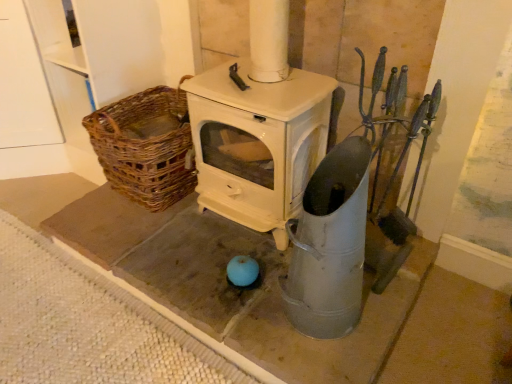
Question: From a real-world perspective, is metallic gray bucket at center on top of woven brown basket at left?

Choices:
 (A) yes
 (B) no

Answer: (A)

Question: Is metallic gray bucket at center positioned before woven brown basket at left?

Choices:
 (A) no
 (B) yes

Answer: (B)

Question: From the image's perspective, is metallic gray bucket at center over woven brown basket at left?

Choices:
 (A) yes
 (B) no

Answer: (B)

Question: Is the surface of metallic gray bucket at center in direct contact with woven brown basket at left?

Choices:
 (A) no
 (B) yes

Answer: (A)

Question: Is metallic gray bucket at center bigger than woven brown basket at left?

Choices:
 (A) no
 (B) yes

Answer: (A)

Question: Considering the relative sizes of metallic gray bucket at center and woven brown basket at left in the image provided, is metallic gray bucket at center smaller than woven brown basket at left?

Choices:
 (A) no
 (B) yes

Answer: (B)

Question: Does woven brown basket at left have a lesser width compared to metallic gray bucket at center?

Choices:
 (A) yes
 (B) no

Answer: (B)

Question: Can metallic gray bucket at center be found inside woven brown basket at left?

Choices:
 (A) no
 (B) yes

Answer: (A)

Question: Is woven brown basket at left bigger than metallic gray bucket at center?

Choices:
 (A) no
 (B) yes

Answer: (B)

Question: Is woven brown basket at left at the right side of metallic gray bucket at center?

Choices:
 (A) no
 (B) yes

Answer: (A)

Question: Does woven brown basket at left have a smaller size compared to metallic gray bucket at center?

Choices:
 (A) yes
 (B) no

Answer: (B)

Question: From the image's perspective, would you say woven brown basket at left is shown under metallic gray bucket at center?

Choices:
 (A) yes
 (B) no

Answer: (B)

Question: Would you say metallic gray bucket at center is inside or outside woven brown basket at left?

Choices:
 (A) inside
 (B) outside

Answer: (B)